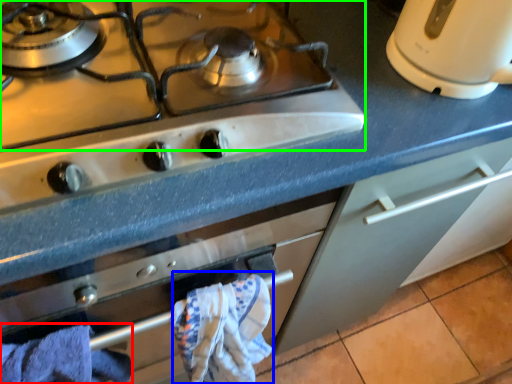
Question: Estimate the real-world distances between objects in this image. Which object is closer to bath towel (highlighted by a red box), bath towel (highlighted by a blue box) or gas stove (highlighted by a green box)?

Choices:
 (A) bath towel
 (B) gas stove

Answer: (A)